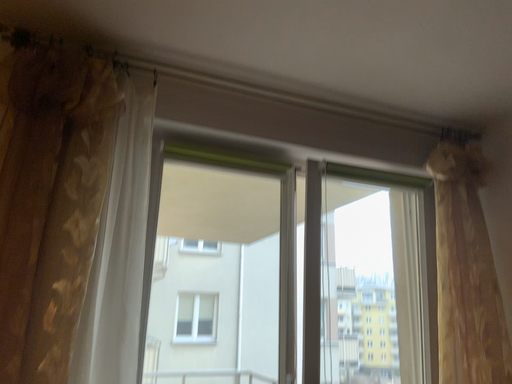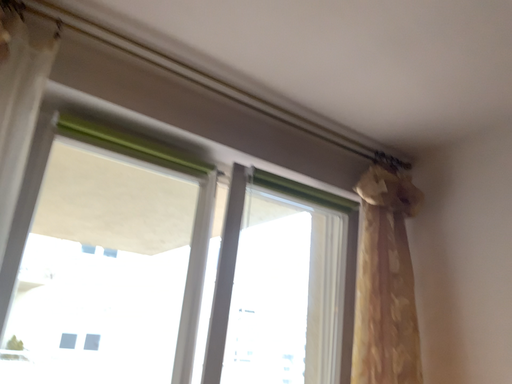
Question: How did the camera likely rotate when shooting the video?

Choices:
 (A) rotated right
 (B) rotated left

Answer: (A)